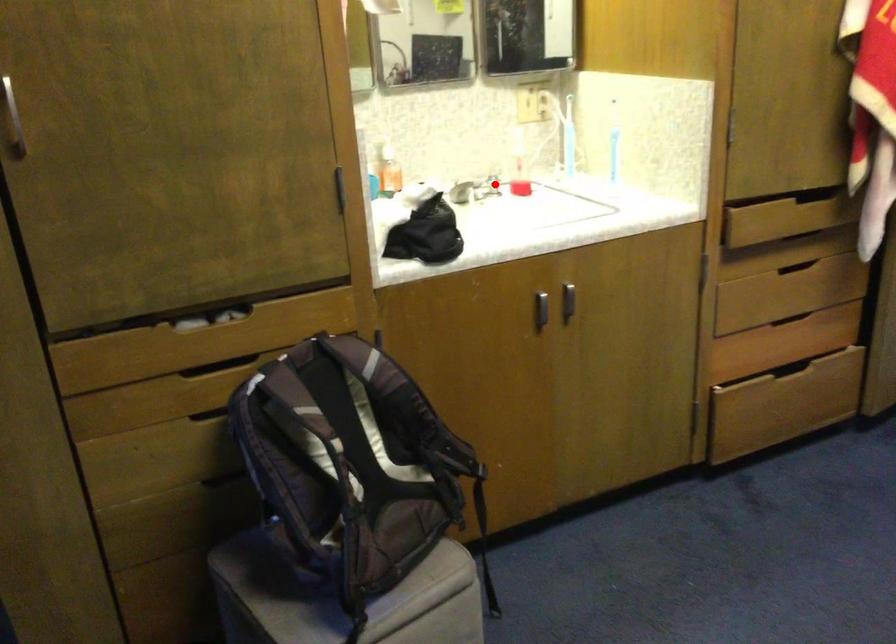
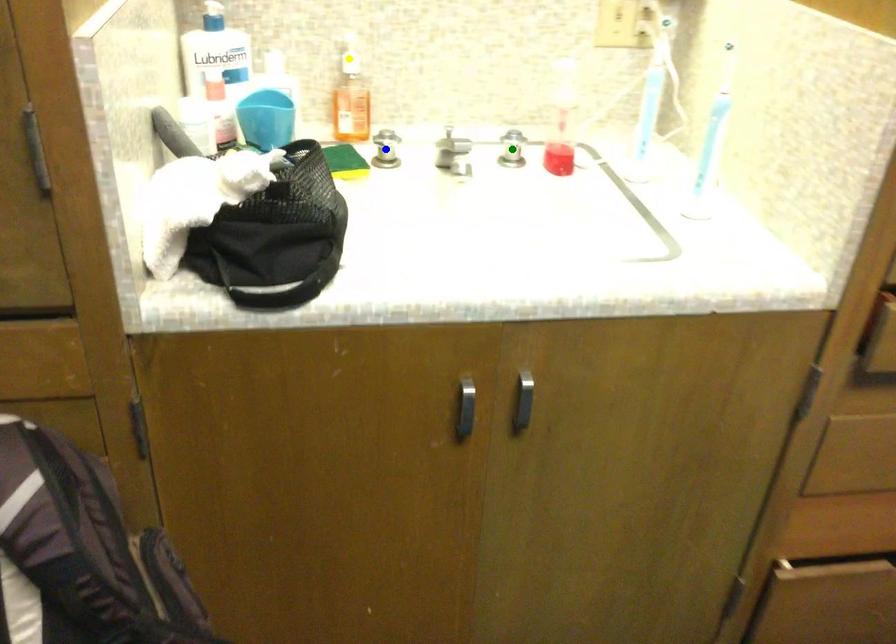
Question: I am providing you with two images of the same scene from different viewpoints. A red point is marked on the first image. You are given multiple points on the second image. In image 2, which mark is for the same physical point as the one in image 1?

Choices:
 (A) blue point
 (B) green point
 (C) yellow point

Answer: (B)